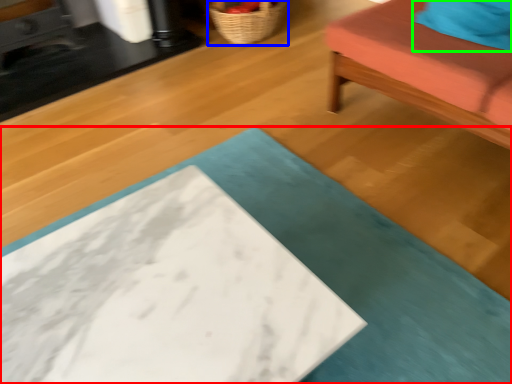
Question: Which object is the farthest from table (highlighted by a red box)? Choose among these: basket (highlighted by a blue box) or pillow (highlighted by a green box).

Choices:
 (A) basket
 (B) pillow

Answer: (A)